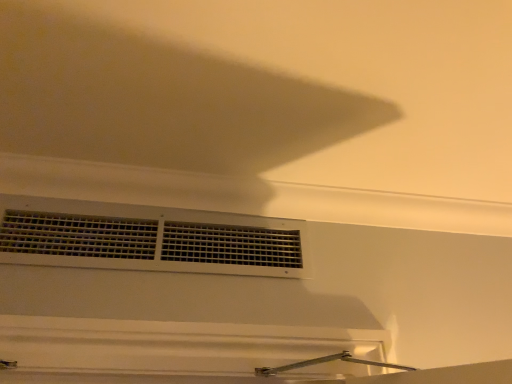
Locate an element on the screen. white matte exhaust hood at upper center is located at coordinates (158, 101).

The width and height of the screenshot is (512, 384). What do you see at coordinates (158, 101) in the screenshot? I see `white matte exhaust hood at upper center` at bounding box center [158, 101].

Consider the image. Measure the distance between point (x=237, y=234) and camera.

The depth of point (x=237, y=234) is 1.33 meters.

Where is `white matte vent at center`? This screenshot has width=512, height=384. white matte vent at center is located at coordinates (146, 238).

Describe the element at coordinates (146, 238) in the screenshot. I see `white matte vent at center` at that location.

Find the location of a particular element. This screenshot has width=512, height=384. white matte exhaust hood at upper center is located at coordinates (158, 101).

Considering the positions of objects white matte exhaust hood at upper center and white matte vent at center in the image provided, who is more to the left, white matte exhaust hood at upper center or white matte vent at center?

white matte vent at center.

Who is more distant, white matte exhaust hood at upper center or white matte vent at center?

white matte vent at center.

Which is less distant, (31,50) or (62,229)?

Point (31,50) is closer to the camera than point (62,229).

From the image's perspective, which is below, white matte exhaust hood at upper center or white matte vent at center?

white matte vent at center is shown below in the image.

In the scene shown: From a real-world perspective, is white matte exhaust hood at upper center located beneath white matte vent at center?

No, from a real-world perspective, white matte exhaust hood at upper center is not beneath white matte vent at center.

Considering the relative sizes of white matte exhaust hood at upper center and white matte vent at center in the image provided, is white matte exhaust hood at upper center thinner than white matte vent at center?

Incorrect, the width of white matte exhaust hood at upper center is not less than that of white matte vent at center.

Between white matte exhaust hood at upper center and white matte vent at center, which one has less height?

white matte exhaust hood at upper center is shorter.

Considering the relative sizes of white matte exhaust hood at upper center and white matte vent at center in the image provided, is white matte exhaust hood at upper center bigger than white matte vent at center?

Yes.

Is white matte exhaust hood at upper center spatially inside white matte vent at center, or outside of it?

white matte exhaust hood at upper center is spatially situated outside white matte vent at center.

Does white matte exhaust hood at upper center touch white matte vent at center?

They are not placed beside each other.

Does white matte exhaust hood at upper center turn towards white matte vent at center?

No, white matte exhaust hood at upper center is not facing towards white matte vent at center.

Where is `window behind the white matte exhaust hood at upper center`? window behind the white matte exhaust hood at upper center is located at coordinates (146, 238).

Does white matte vent at center appear on the right side of white matte exhaust hood at upper center?

In fact, white matte vent at center is to the left of white matte exhaust hood at upper center.

Which object is further away from the camera, white matte vent at center or white matte exhaust hood at upper center?

white matte vent at center is further from the camera.

Considering the positions of points (31, 203) and (271, 149), is point (31, 203) closer to camera compared to point (271, 149)?

That is False.

From the image's perspective, between white matte vent at center and white matte exhaust hood at upper center, who is located below?

white matte vent at center.

From a real-world perspective, is white matte vent at center located beneath white matte exhaust hood at upper center?

Yes.

Between white matte vent at center and white matte exhaust hood at upper center, which one has larger width?

Wider between the two is white matte exhaust hood at upper center.

Does white matte vent at center have a greater height compared to white matte exhaust hood at upper center?

Yes.

From the picture: Who is smaller, white matte vent at center or white matte exhaust hood at upper center?

white matte vent at center is smaller.

Can we say white matte vent at center lies outside white matte exhaust hood at upper center?

That's correct, white matte vent at center is outside of white matte exhaust hood at upper center.

Based on the photo, is white matte vent at center far away from white matte exhaust hood at upper center?

No, white matte vent at center is in close proximity to white matte exhaust hood at upper center.

Is white matte exhaust hood at upper center at the back of white matte vent at center?

white matte vent at center is not turned away from white matte exhaust hood at upper center.

How different are the orientations of white matte vent at center and white matte exhaust hood at upper center in degrees?

There is a 180-degree angle between the facing directions of white matte vent at center and white matte exhaust hood at upper center.

Locate an element on the screen. This screenshot has height=384, width=512. window behind the white matte exhaust hood at upper center is located at coordinates (146, 238).

You are a GUI agent. You are given a task and a screenshot of the screen. Output one action in this format:
    pyautogui.click(x=<x>, y=<y>)
    Task: Click on the window that appears below the white matte exhaust hood at upper center (from a real-world perspective)
    This screenshot has width=512, height=384.
    Given the screenshot: What is the action you would take?
    pyautogui.click(x=146, y=238)

Where is `exhaust hood that is above the white matte vent at center (from the image's perspective)`? exhaust hood that is above the white matte vent at center (from the image's perspective) is located at coordinates (158, 101).